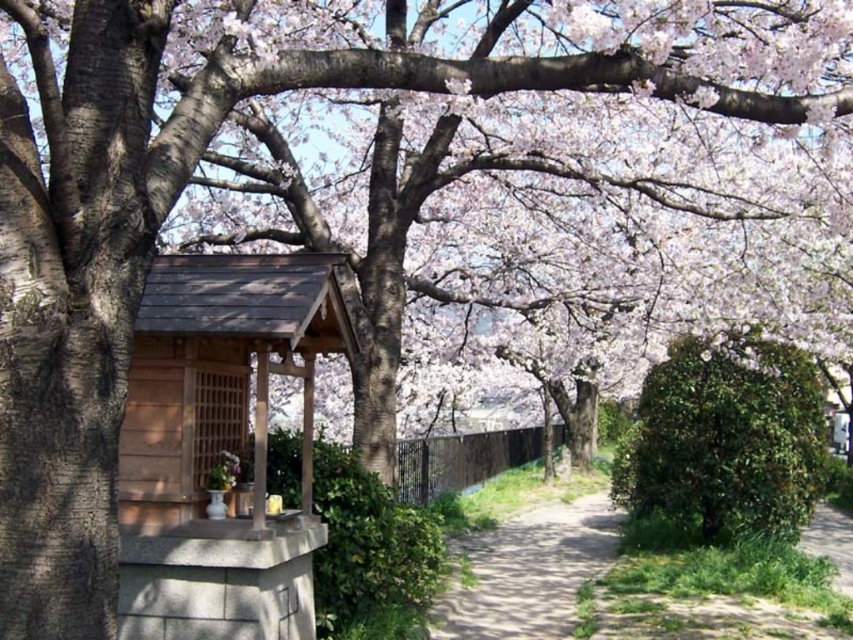
Is point (146, 608) closer to camera compared to point (654, 477)?

Yes, it is in front of point (654, 477).

Which is more to the right, wooden gazebo at center or green leafy bush at center?

Positioned to the right is green leafy bush at center.

Identify the location of wooden gazebo at center. (219, 444).

Identify the location of wooden gazebo at center. (219, 444).

Who is positioned more to the left, wooden gazebo at center or dirt path at center?

From the viewer's perspective, wooden gazebo at center appears more on the left side.

Who is taller, wooden gazebo at center or dirt path at center?

wooden gazebo at center

Does point (129, 476) lie in front of point (596, 564)?

Yes, it is in front of point (596, 564).

The height and width of the screenshot is (640, 853). Find the location of `wooden gazebo at center`. wooden gazebo at center is located at coordinates (219, 444).

Does green leafy bush at center have a lesser height compared to dirt path at lower right?

No.

Between point (693, 349) and point (848, 576), which one is positioned behind?

Point (693, 349)

Describe the element at coordinates (724, 440) in the screenshot. The image size is (853, 640). I see `green leafy bush at center` at that location.

Where is `green leafy bush at center`? green leafy bush at center is located at coordinates (724, 440).